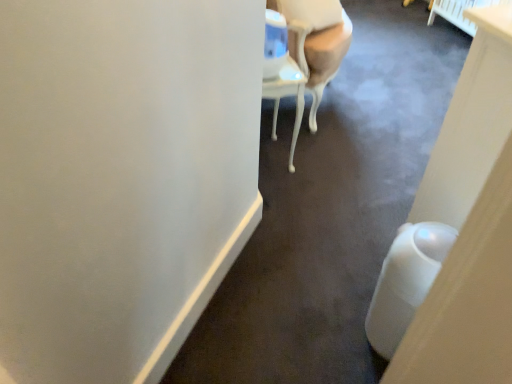
Image resolution: width=512 pixels, height=384 pixels. In order to click on free location to the right of white glossy chair at upper center in this screenshot , I will do `click(406, 117)`.